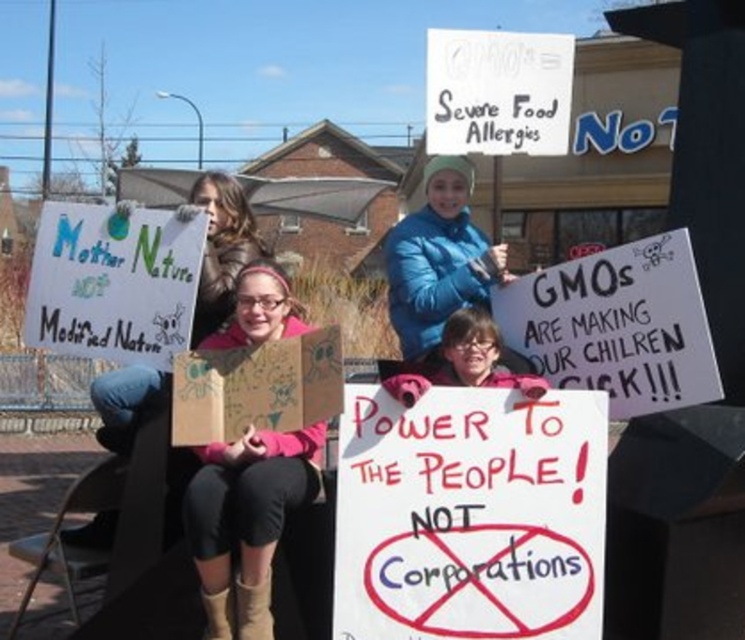
Question: Does white paper sign at center right appear on the left side of blue puffy jacket at center?

Choices:
 (A) yes
 (B) no

Answer: (B)

Question: Is white cardboard sign at center below metallic folding chair at lower left?

Choices:
 (A) yes
 (B) no

Answer: (B)

Question: Can you confirm if white paper sign at center right is smaller than blue puffy jacket at center?

Choices:
 (A) no
 (B) yes

Answer: (B)

Question: Based on their relative distances, which object is nearer to the white cardboard sign at center?

Choices:
 (A) blue puffy jacket at center
 (B) pink fabric shirt at center
 (C) white paper sign at upper center

Answer: (B)

Question: Which object appears closest to the camera in this image?

Choices:
 (A) metallic folding chair at lower left
 (B) white paper sign at center right

Answer: (B)

Question: Which object appears closest to the camera in this image?

Choices:
 (A) blue puffy jacket at center
 (B) metallic folding chair at lower left

Answer: (A)